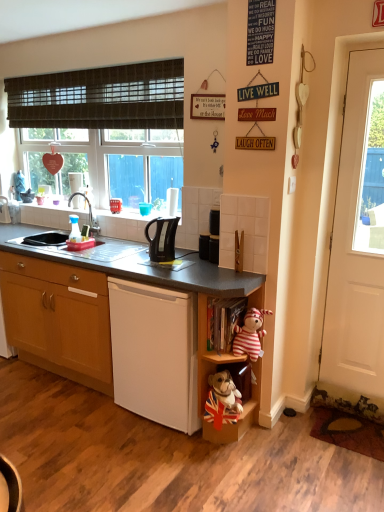
You are a GUI agent. You are given a task and a screenshot of the screen. Output one action in this format:
    pyautogui.click(x=<x>, y=<y>)
    Task: Click on the vacant space to the left of black plastic kettle at center
    The image size is (384, 512).
    Given the screenshot: What is the action you would take?
    pyautogui.click(x=137, y=259)